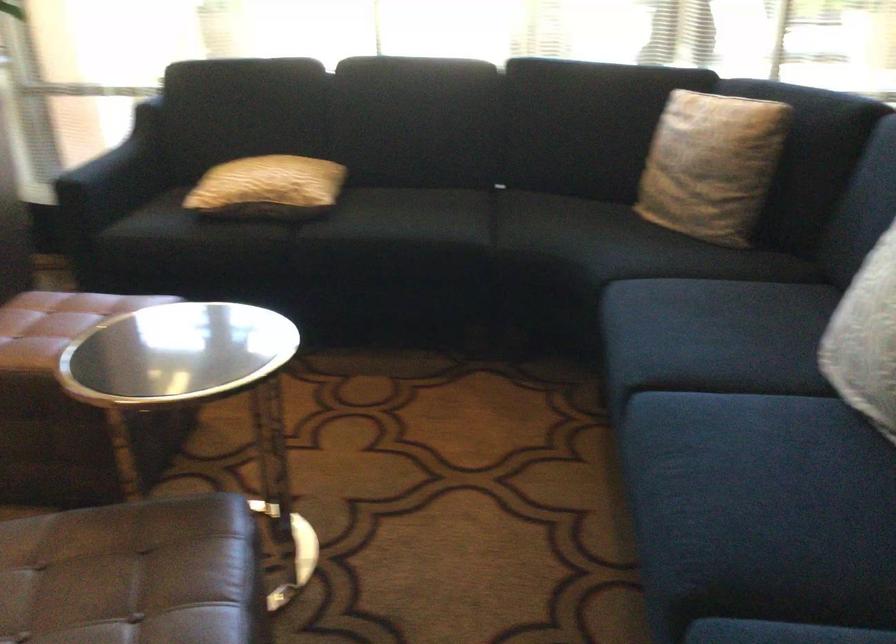
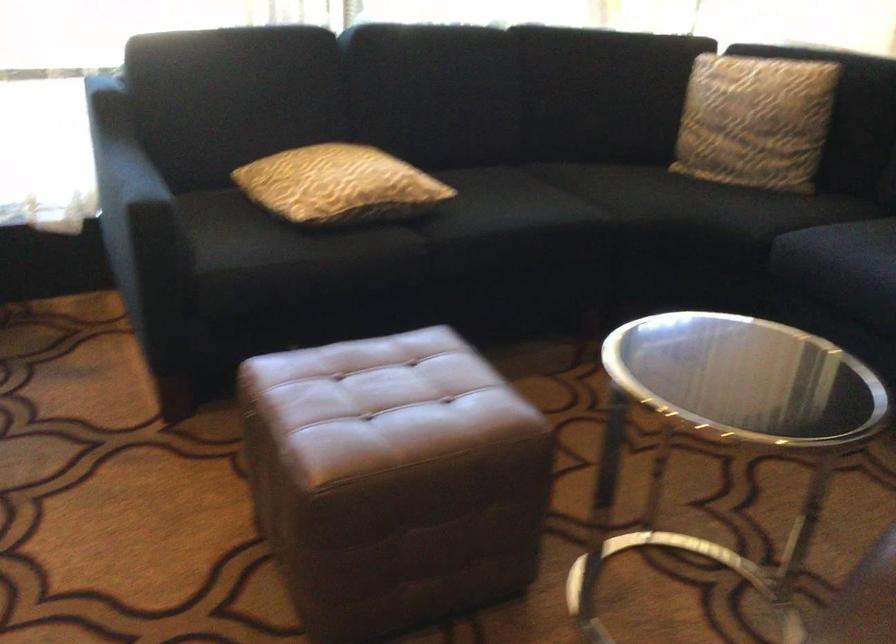
Locate, in the second image, the point that corresponds to [238,182] in the first image.

(339, 185)